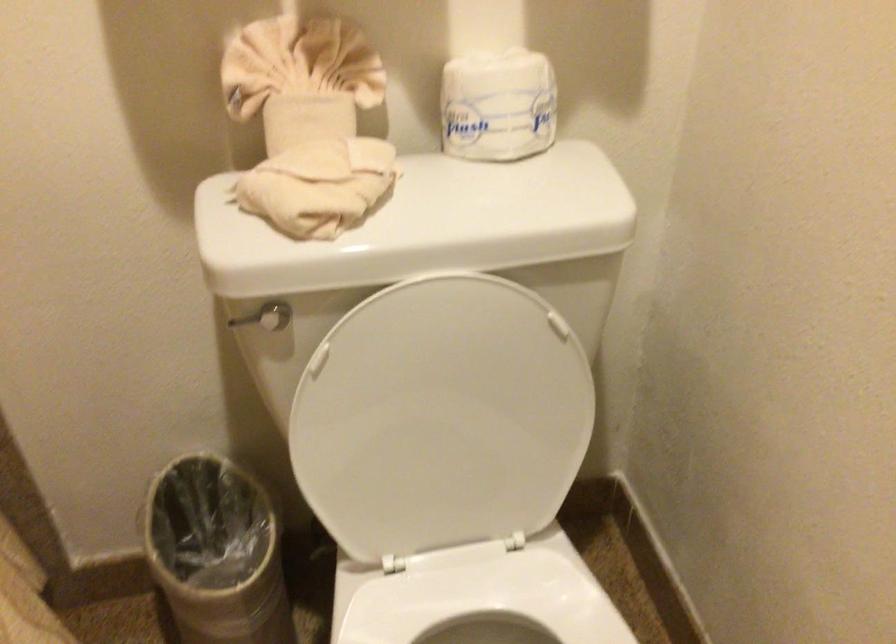
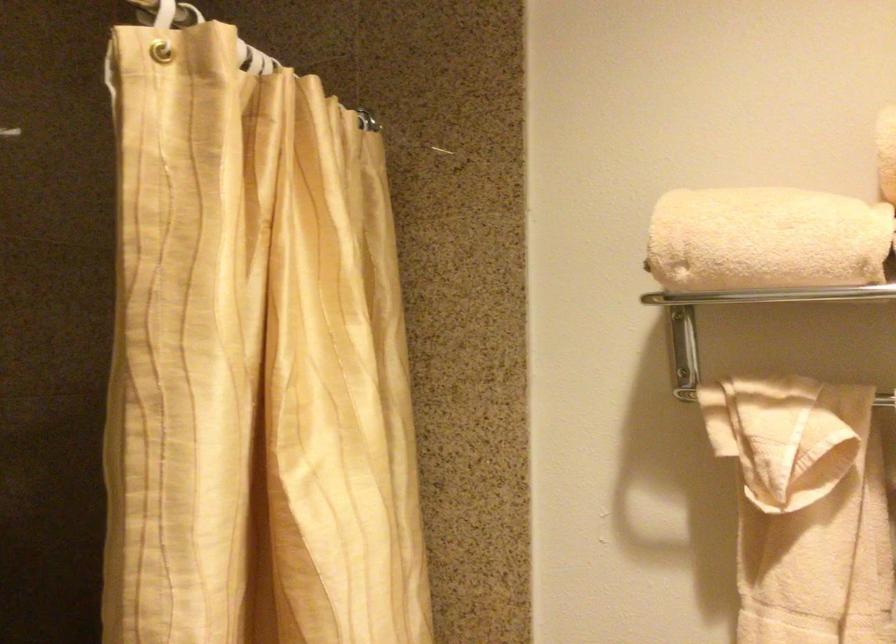
First-person continuous shooting, in which direction is the camera rotating?

The camera's rotation is toward left-up.